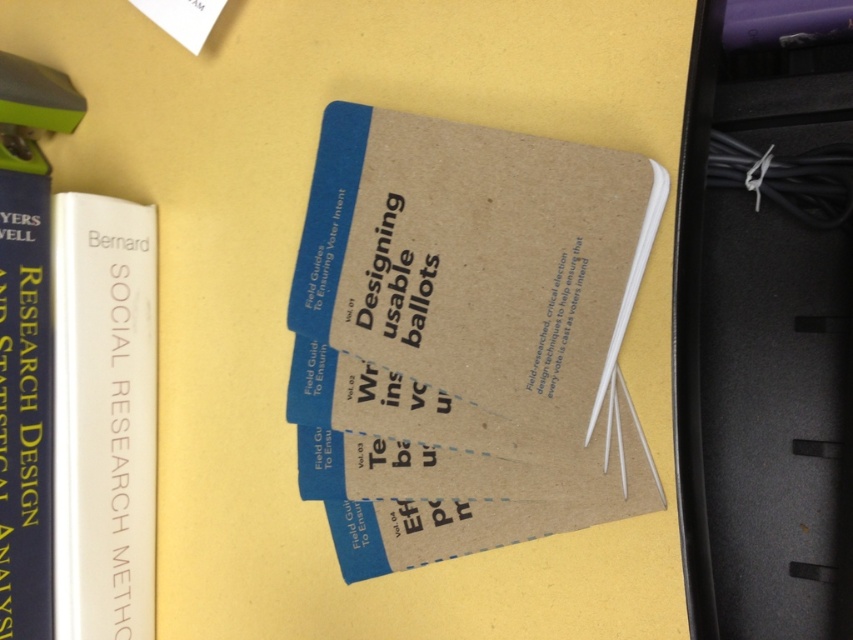
Is point (141, 246) positioned after point (33, 513)?

Yes.

Between white matte book at left and matte blue book at left, which one is positioned lower?

white matte book at left is below.

Who is more forward, (125, 476) or (4, 476)?

Point (4, 476) is in front.

Where is `white matte book at left`? The image size is (853, 640). white matte book at left is located at coordinates (103, 417).

Does point (659, 195) come farther from viewer compared to point (45, 380)?

No, it is in front of (45, 380).

Identify the location of kraft paper notebook at center. [465, 337].

Can you confirm if kraft paper notebook at center is taller than white matte book at left?

Yes, kraft paper notebook at center is taller than white matte book at left.

Is kraft paper notebook at center below white matte book at left?

No.

Is point (640, 259) farther from camera compared to point (144, 385)?

No, it is not.

Locate an element on the screen. kraft paper notebook at center is located at coordinates (465, 337).